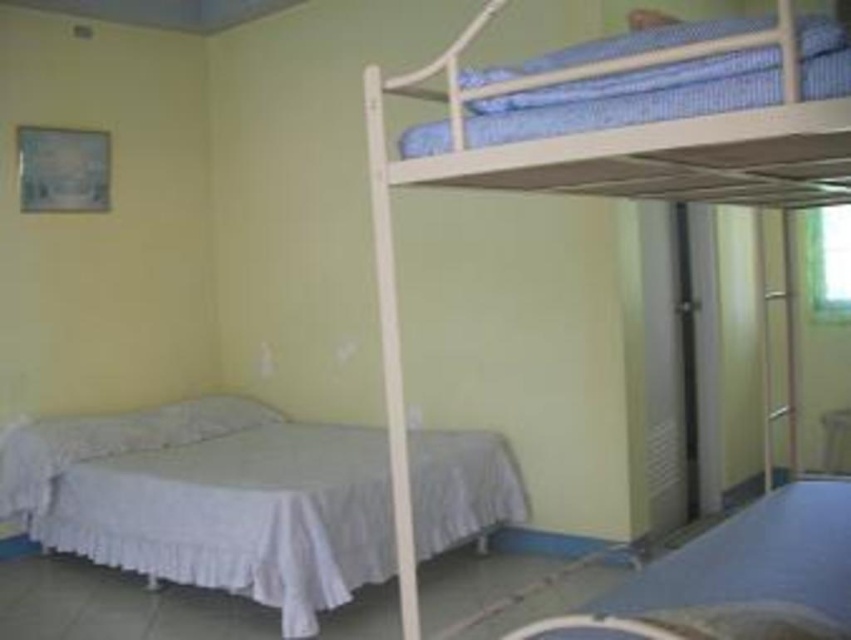
You are a delivery person who needs to place a 4 feet long package between the white matte bedcover at lower right and the blue striped pillow at upper right. Can you fit it there?

The distance between the white matte bedcover at lower right and the blue striped pillow at upper right is 3.98 feet, so the 4 feet long package cannot be placed there as it is slightly longer than the available space.

You are a guest staying in this room and want to place a small lamp on the bed that is closer to the window. Which bed should you choose between the white matte bedcover at lower right and the blue striped pillow at upper right?

The white matte bedcover at lower right is positioned on the right side of blue striped pillow at upper right. Therefore, the white matte bedcover at lower right is closer to the window and should be chosen for placing the lamp.